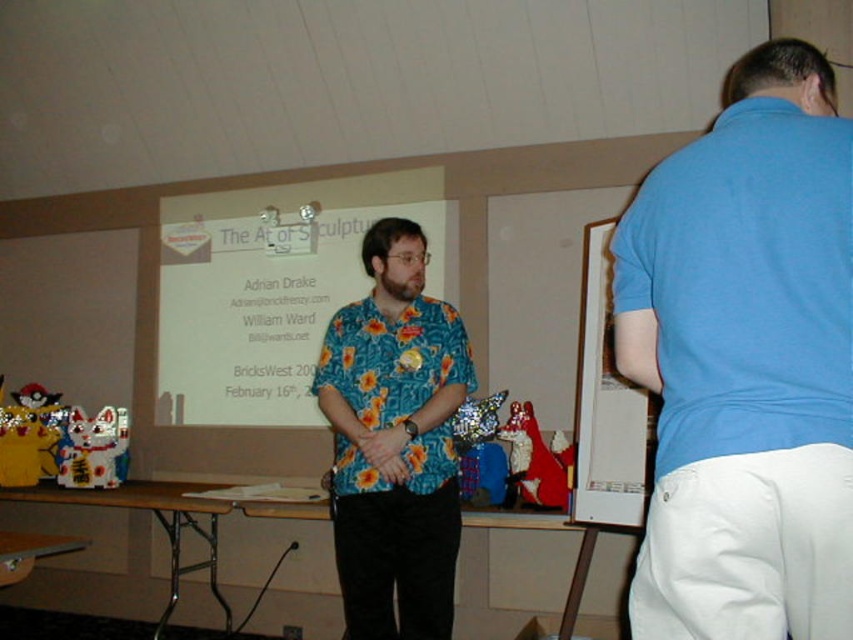
Does floral fabric shirt at center appear under white paper at upper center?

Indeed, floral fabric shirt at center is positioned under white paper at upper center.

Is point (431, 420) more distant than point (608, 508)?

No, (431, 420) is closer to viewer.

Where is `floral fabric shirt at center`? Image resolution: width=853 pixels, height=640 pixels. floral fabric shirt at center is located at coordinates (393, 442).

From the picture: Does blue cotton shirt at upper right come in front of floral fabric shirt at center?

Yes, blue cotton shirt at upper right is closer to the viewer.

Does point (778, 116) lie in front of point (453, 502)?

Yes, point (778, 116) is closer to viewer.

Is point (784, 120) positioned behind point (370, 618)?

No, it is not.

The height and width of the screenshot is (640, 853). I want to click on blue cotton shirt at upper right, so click(x=746, y=362).

Which is below, blue cotton shirt at upper right or white paper at upper center?

white paper at upper center is below.

In the scene shown: Who is shorter, blue cotton shirt at upper right or white paper at upper center?

white paper at upper center is shorter.

Which is in front, point (846, 227) or point (624, 428)?

Point (846, 227)

Locate an element on the screen. The image size is (853, 640). blue cotton shirt at upper right is located at coordinates (746, 362).